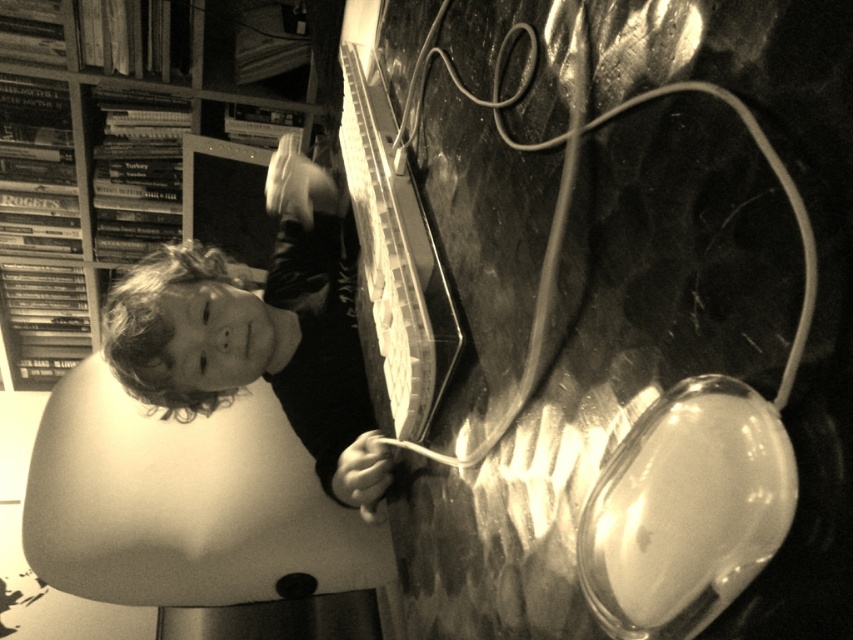
Question: Which object is closer to the camera taking this photo?

Choices:
 (A) wooden bookshelf at upper left
 (B) smooth skin child at upper left

Answer: (B)

Question: Which object is closer to the camera taking this photo?

Choices:
 (A) wooden bookshelf at upper left
 (B) smooth skin child at upper left

Answer: (B)

Question: Does smooth skin child at upper left appear on the left side of wooden bookshelf at upper left?

Choices:
 (A) yes
 (B) no

Answer: (B)

Question: Is smooth skin child at upper left positioned behind wooden bookshelf at upper left?

Choices:
 (A) no
 (B) yes

Answer: (A)

Question: Considering the relative positions of smooth skin child at upper left and wooden bookshelf at upper left in the image provided, where is smooth skin child at upper left located with respect to wooden bookshelf at upper left?

Choices:
 (A) left
 (B) right

Answer: (B)